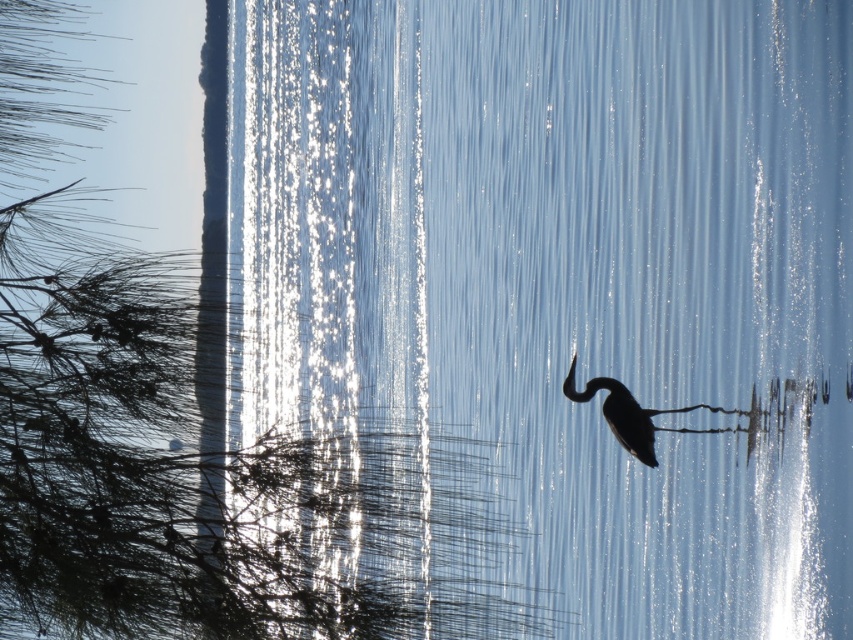
Question: Is green leafy tree at upper left to the left of silhouette matte bird at center from the viewer's perspective?

Choices:
 (A) no
 (B) yes

Answer: (B)

Question: Can you confirm if green leafy tree at upper left is wider than silhouette matte bird at center?

Choices:
 (A) no
 (B) yes

Answer: (B)

Question: Among these points, which one is nearest to the camera?

Choices:
 (A) (618, 429)
 (B) (367, 282)

Answer: (A)

Question: Is green leafy tree at upper left smaller than silhouette matte bird at center?

Choices:
 (A) no
 (B) yes

Answer: (A)